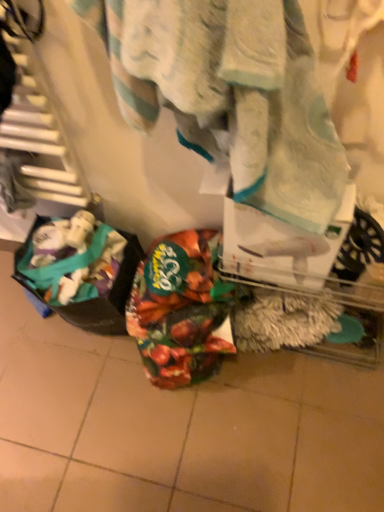
Question: Is white textured towel at center smaller than plastic bag at lower left, marked as the first waste in a left-to-right arrangement?

Choices:
 (A) yes
 (B) no

Answer: (B)

Question: Can you confirm if white textured towel at center is positioned to the left of plastic bag at lower left, the 2th waste from the right?

Choices:
 (A) yes
 (B) no

Answer: (B)

Question: Is white textured towel at center at the right side of plastic bag at lower left, marked as the first waste in a left-to-right arrangement?

Choices:
 (A) no
 (B) yes

Answer: (B)

Question: Are white textured towel at center and plastic bag at lower left, marked as the first waste in a left-to-right arrangement, beside each other?

Choices:
 (A) yes
 (B) no

Answer: (B)

Question: Is white textured towel at center bigger than plastic bag at lower left, the 2th waste from the right?

Choices:
 (A) yes
 (B) no

Answer: (A)

Question: Choose the correct answer: Is shiny metallic bag at center, the first waste viewed from the right, inside white textured towel at center or outside it?

Choices:
 (A) outside
 (B) inside

Answer: (A)

Question: In terms of size, does shiny metallic bag at center, the first waste viewed from the right, appear bigger or smaller than white textured towel at center?

Choices:
 (A) big
 (B) small

Answer: (B)

Question: Looking at their shapes, would you say shiny metallic bag at center, the first waste viewed from the right, is wider or thinner than white textured towel at center?

Choices:
 (A) wide
 (B) thin

Answer: (A)

Question: From the image's perspective, relative to white textured towel at center, is shiny metallic bag at center, the second waste viewed from the left, above or below?

Choices:
 (A) below
 (B) above

Answer: (A)

Question: Relative to plastic bag at lower left, marked as the first waste in a left-to-right arrangement, is white textured towel at center in front or behind?

Choices:
 (A) front
 (B) behind

Answer: (A)

Question: In terms of height, does white textured towel at center look taller or shorter compared to plastic bag at lower left, the 2th waste from the right?

Choices:
 (A) tall
 (B) short

Answer: (B)

Question: Is white textured towel at center wider or thinner than plastic bag at lower left, marked as the first waste in a left-to-right arrangement?

Choices:
 (A) thin
 (B) wide

Answer: (A)

Question: From a real-world perspective, is white textured towel at center physically located above or below plastic bag at lower left, marked as the first waste in a left-to-right arrangement?

Choices:
 (A) below
 (B) above

Answer: (B)

Question: Is white textured towel at center inside or outside of shiny metallic bag at center, the first waste viewed from the right?

Choices:
 (A) outside
 (B) inside

Answer: (A)

Question: Visually, is white textured towel at center positioned to the left or to the right of shiny metallic bag at center, the first waste viewed from the right?

Choices:
 (A) right
 (B) left

Answer: (A)